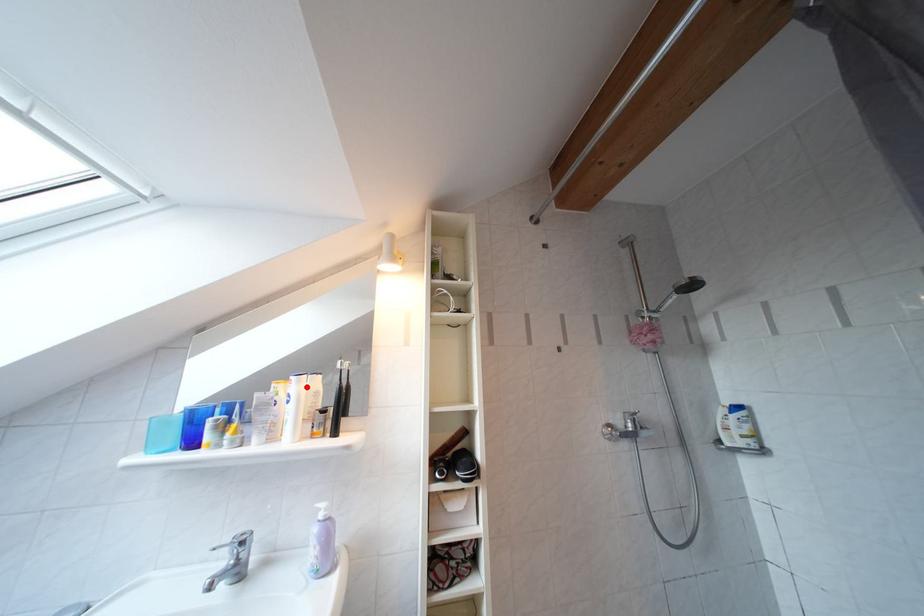
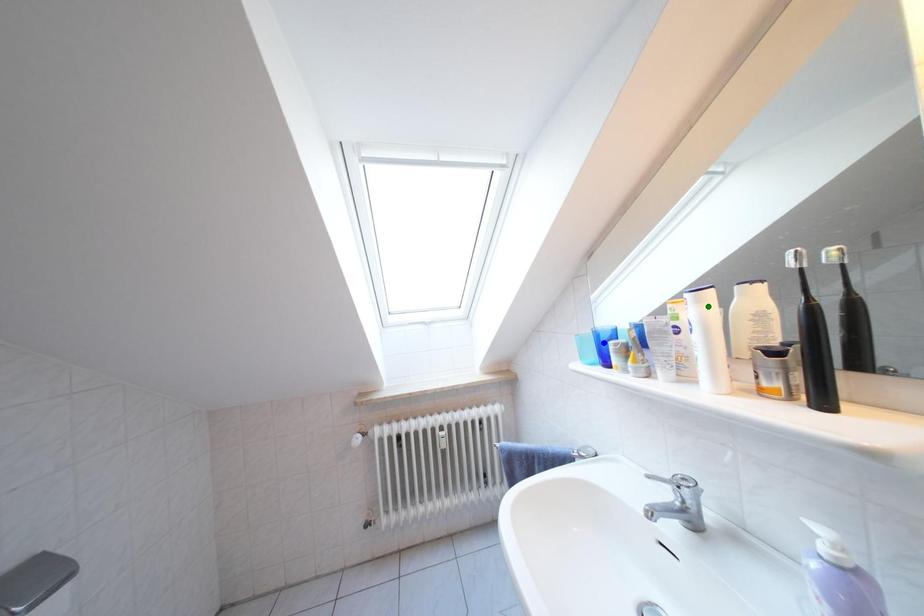
Question: I am providing you with two images of the same scene from different viewpoints. A red point is marked on the first image. You are given multiple points on the second image. Which point in image 2 represents the same 3d spot as the red point in image 1?

Choices:
 (A) green point
 (B) yellow point
 (C) blue point

Answer: (A)